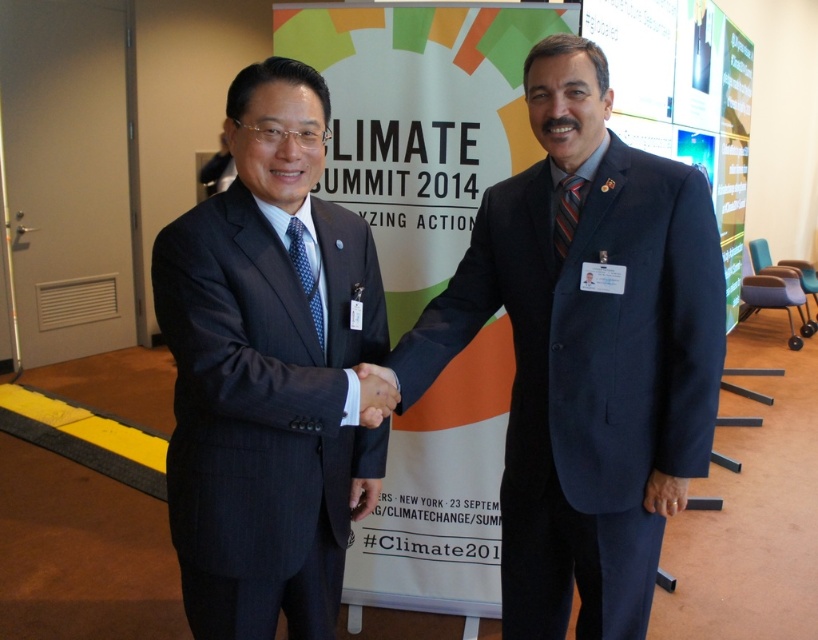
Does black smooth hand at center have a larger size compared to blue dotted tie at center?

Indeed, black smooth hand at center has a larger size compared to blue dotted tie at center.

This screenshot has width=818, height=640. What do you see at coordinates (375, 394) in the screenshot?
I see `black smooth hand at center` at bounding box center [375, 394].

Is point (371, 378) closer to viewer compared to point (317, 308)?

That is True.

Where is `black smooth hand at center`? black smooth hand at center is located at coordinates (375, 394).

Who is shorter, dark blue suit at center or striped silk tie at right?

striped silk tie at right is shorter.

Which is behind, point (484, 212) or point (569, 205)?

Point (484, 212)

Does point (509, 460) come farther from viewer compared to point (556, 221)?

Yes, it is behind point (556, 221).

Find the location of a particular element. dark blue suit at center is located at coordinates (587, 355).

Does dark gray suit at center appear under striped silk tie at right?

Yes.

What do you see at coordinates (268, 372) in the screenshot? I see `dark gray suit at center` at bounding box center [268, 372].

Where is `dark gray suit at center`? This screenshot has width=818, height=640. dark gray suit at center is located at coordinates (268, 372).